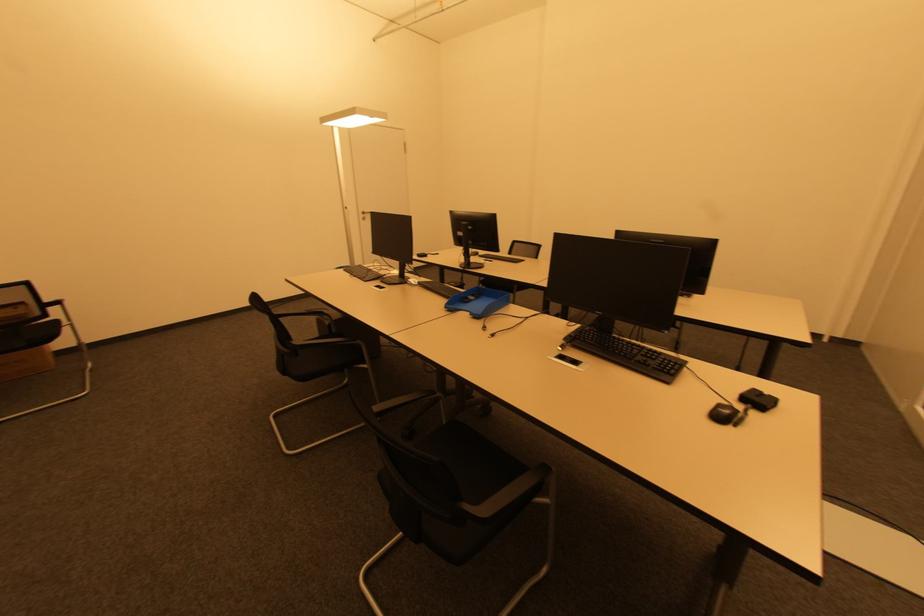
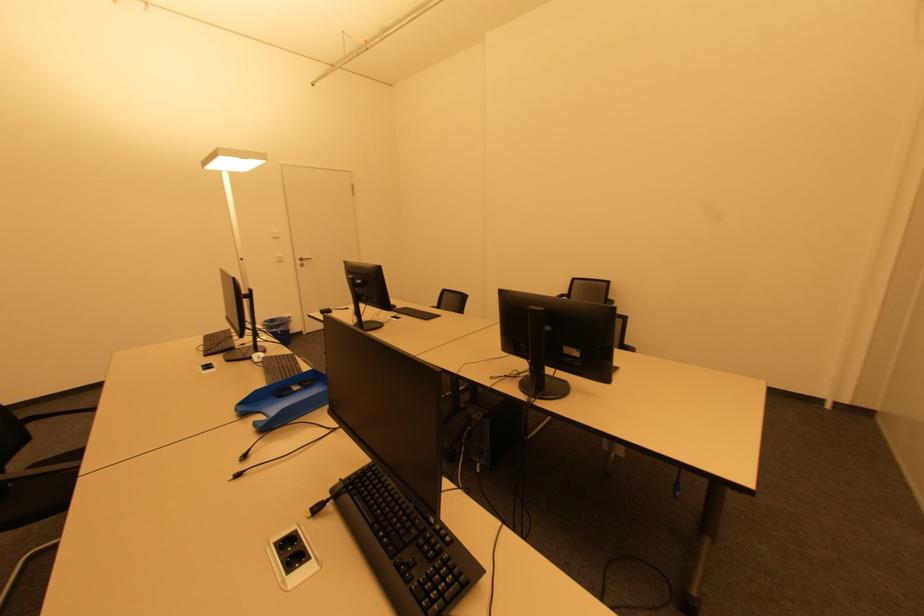
In a continuous first-person perspective shot, in which direction is the camera moving?

The movement direction of the cameraman is right, forward.